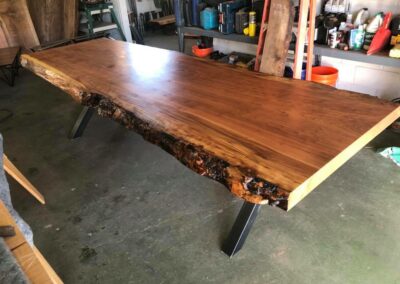
Locate an element on the screen. This screenshot has width=400, height=284. wood slab is located at coordinates (189, 81).